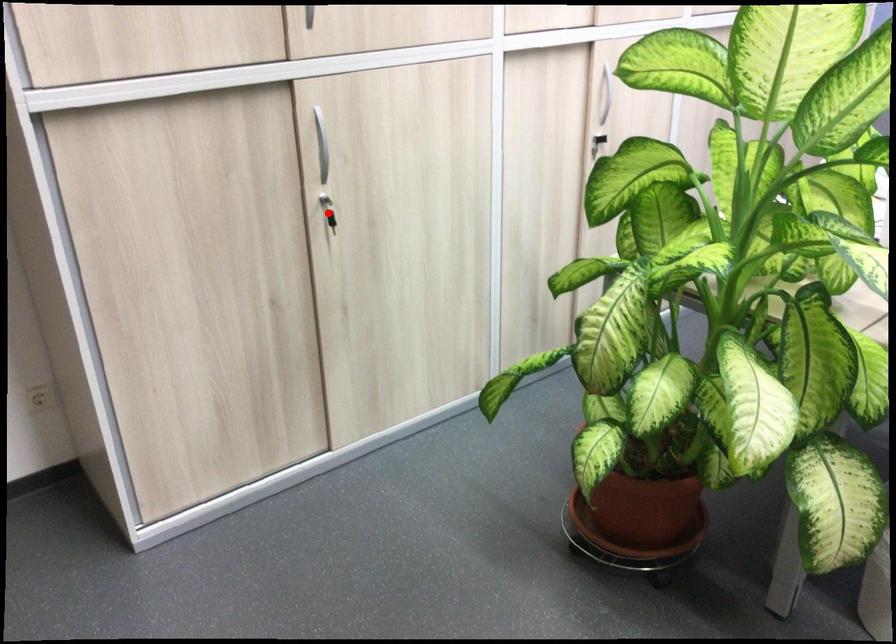
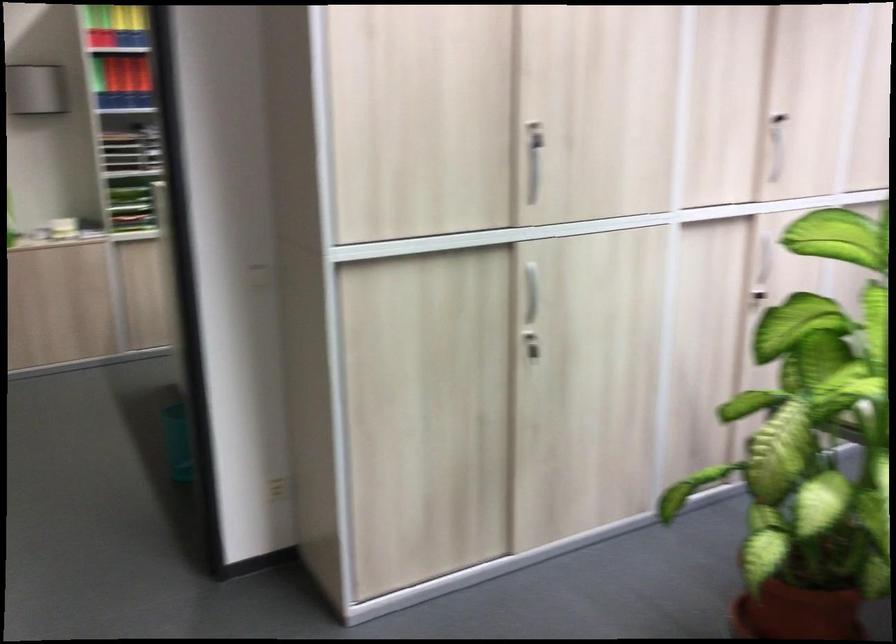
In the second image, find the point that corresponds to the highlighted location in the first image.

(530, 345)